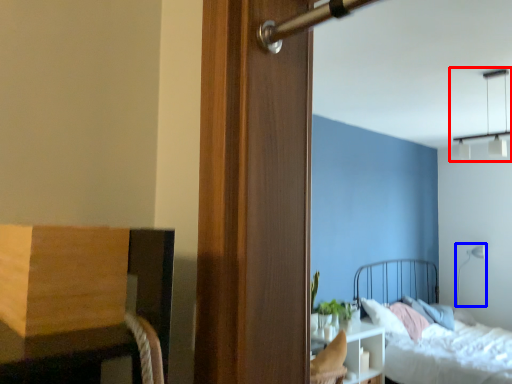
Question: Among these objects, which one is farthest to the camera, light fixture (highlighted by a red box) or light fixture (highlighted by a blue box)?

Choices:
 (A) light fixture
 (B) light fixture

Answer: (B)